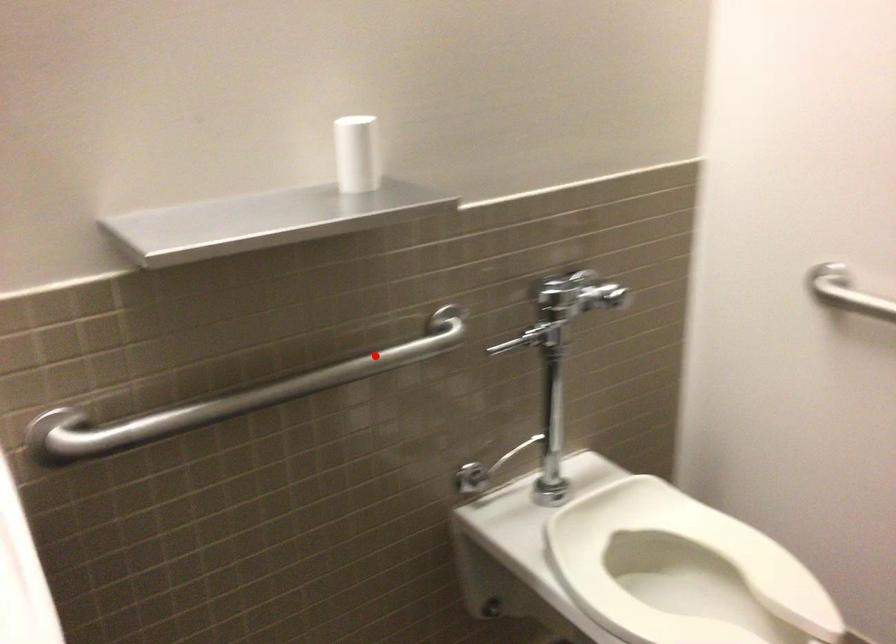
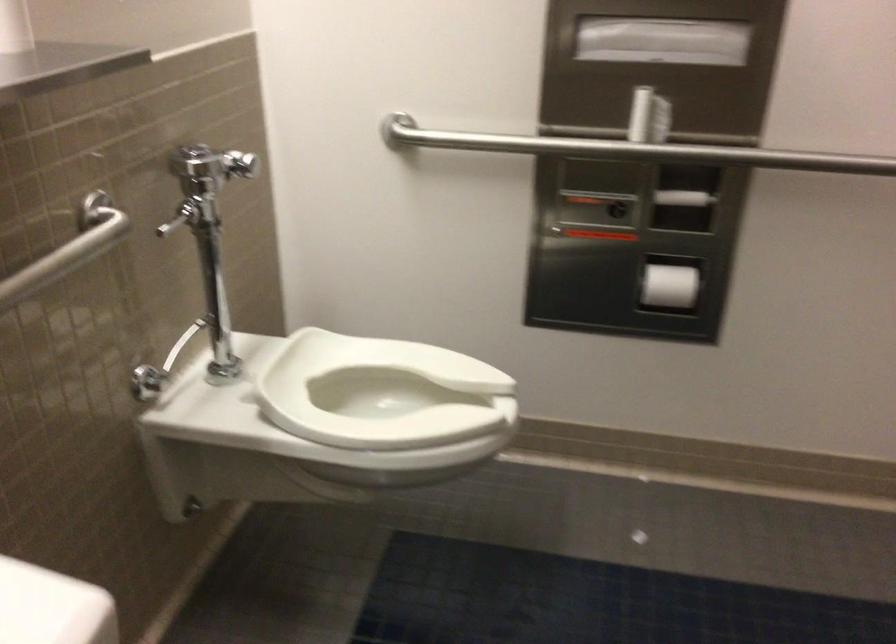
Question: I am providing you with two images of the same scene from different viewpoints. A red point is shown in image1. For the corresponding object point in image2, is it positioned nearer or farther from the camera?

Choices:
 (A) Nearer
 (B) Farther

Answer: (A)